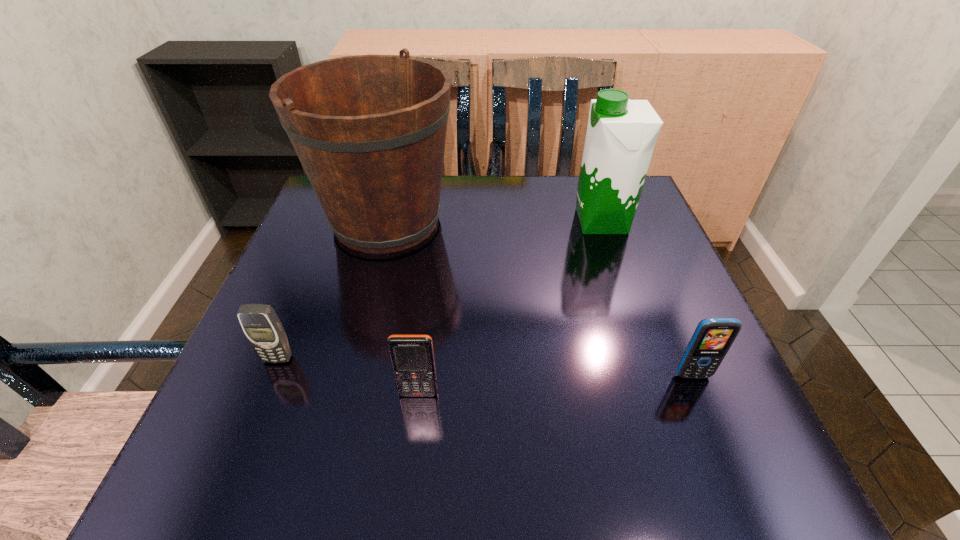
Identify the location of bucket. The height and width of the screenshot is (540, 960). (369, 130).

In order to click on soya milk in this screenshot , I will do `click(621, 135)`.

This screenshot has height=540, width=960. Find the location of `the nearest cellular telephone`. the nearest cellular telephone is located at coordinates (412, 358).

Where is `the second cellular telephone from left to right`? The height and width of the screenshot is (540, 960). the second cellular telephone from left to right is located at coordinates (412, 358).

At what (x,y) coordinates should I click in order to perform the action: click on the second nearest cellular telephone. Please return your answer as a coordinate pair (x, y). Looking at the image, I should click on (713, 337).

You are a GUI agent. You are given a task and a screenshot of the screen. Output one action in this format:
    pyautogui.click(x=<x>, y=<y>)
    Task: Click on the fourth farthest object
    This screenshot has height=540, width=960.
    Given the screenshot: What is the action you would take?
    pyautogui.click(x=713, y=337)

Where is `the farthest cellular telephone`? Image resolution: width=960 pixels, height=540 pixels. the farthest cellular telephone is located at coordinates (260, 323).

Locate an element on the screen. The image size is (960, 540). the third farthest object is located at coordinates click(260, 323).

Identify the location of vacant region located on the right of the bucket. (550, 221).

Where is `blank space located 0.110m on the front-facing side of the soya milk`? The height and width of the screenshot is (540, 960). blank space located 0.110m on the front-facing side of the soya milk is located at coordinates (527, 221).